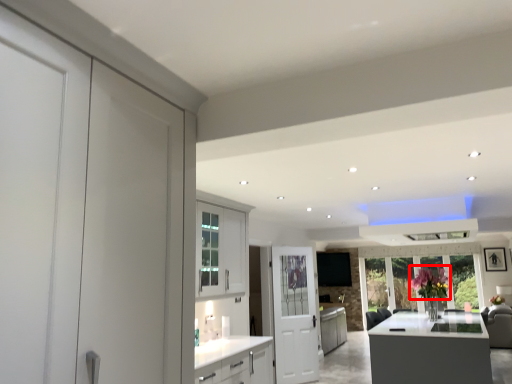
Question: Observing the image, what is the correct spatial positioning of flower (annotated by the red box) in reference to door?

Choices:
 (A) left
 (B) right

Answer: (B)